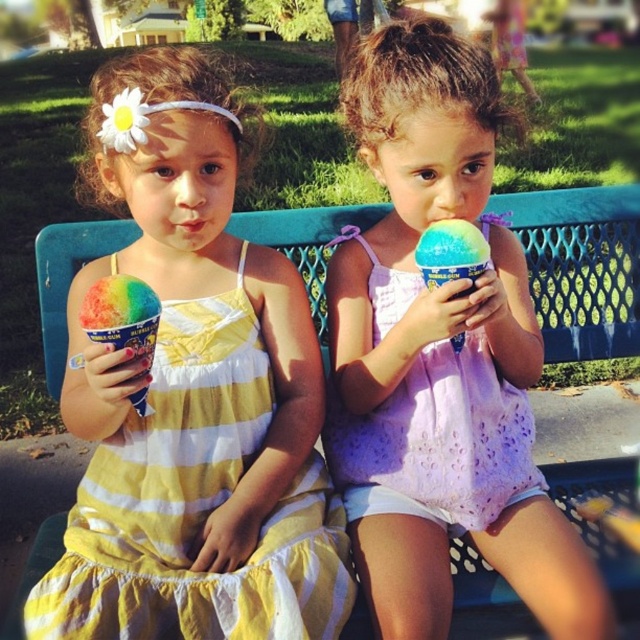
You are a photographer trying to capture the rainbow ice cream at left and the pastel rainbow ice cream at center in a single shot. Based on their positions, which one is closer to the ground?

The rainbow ice cream at left is located below the pastel rainbow ice cream at center, so it is closer to the ground.

You are a photographer setting up for a group photo. You need to position the yellow striped fabric dress at left and the lavender sheer top at center so that they are exactly 10 inches apart. Based on their current positions, do you need to move them closer together or farther apart?

The yellow striped fabric dress at left is currently 9.43 inches away from the lavender sheer top at center. To reach the desired 10 inches, they need to be moved slightly farther apart.